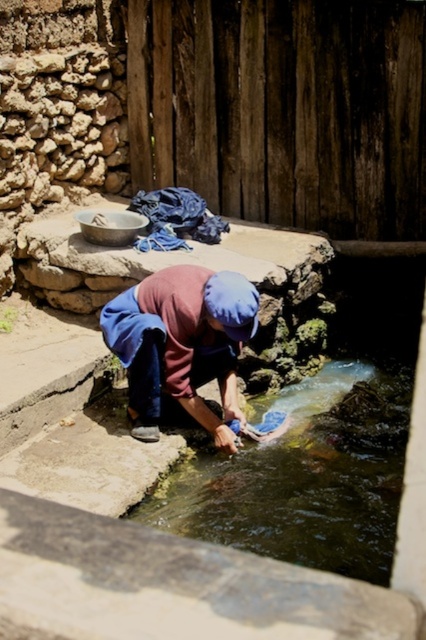
You are standing at the camera position and want to know how far the point at coordinates (380, 449) is from you. Can you determine the distance?

The point at coordinates (380, 449) is 4.49 meters away from you.

You are a traveler carrying a water bottle and need to refill it. You see a clear water stream at center and a blue fabric at center. Which one is closer to you?

The clear water stream at center is closer to you, as it is only 85.19 centimeters away from the blue fabric at center.